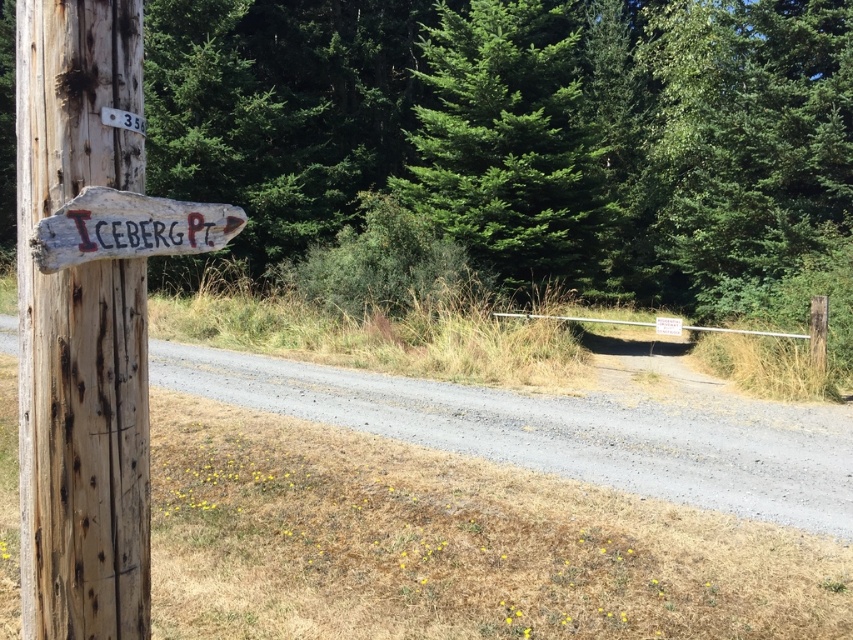
Who is positioned more to the left, weathered wood sign at left or white painted wood at upper left?

weathered wood sign at left

Does weathered wood sign at left have a lesser height compared to white painted wood at upper left?

Incorrect, weathered wood sign at left's height does not fall short of white painted wood at upper left's.

The width and height of the screenshot is (853, 640). Describe the element at coordinates (80, 332) in the screenshot. I see `weathered wood sign at left` at that location.

Locate an element on the screen. This screenshot has width=853, height=640. weathered wood sign at left is located at coordinates (80, 332).

Does green evergreen tree at center appear under white painted wood at upper left?

No.

Is point (454, 72) positioned after point (136, 116)?

Yes.

Is point (543, 211) positioned behind point (111, 122)?

Yes, it is behind point (111, 122).

Where is `green evergreen tree at center`? This screenshot has width=853, height=640. green evergreen tree at center is located at coordinates (509, 145).

Is point (62, 17) positioned after point (432, 186)?

No, it is in front of (432, 186).

Does point (74, 456) come closer to viewer compared to point (503, 3)?

Yes, it is in front of point (503, 3).

Find the location of a particular element. weathered wood sign at left is located at coordinates (80, 332).